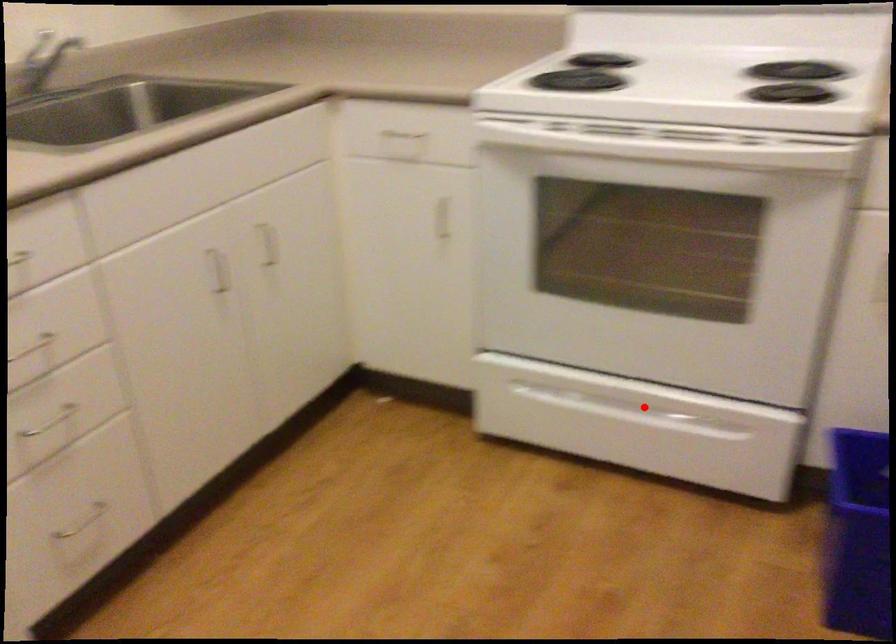
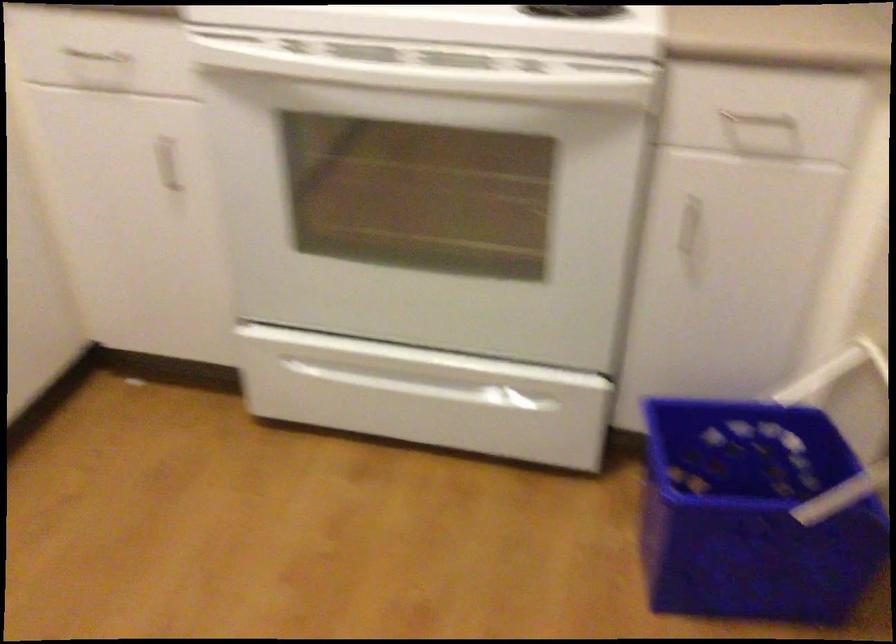
Question: A red point is marked in image1. In image2, is the corresponding 3D point closer to the camera or farther? Reply with the corresponding letter.

Choices:
 (A) The corresponding 3D point is closer.
 (B) The corresponding 3D point is farther.

Answer: (A)